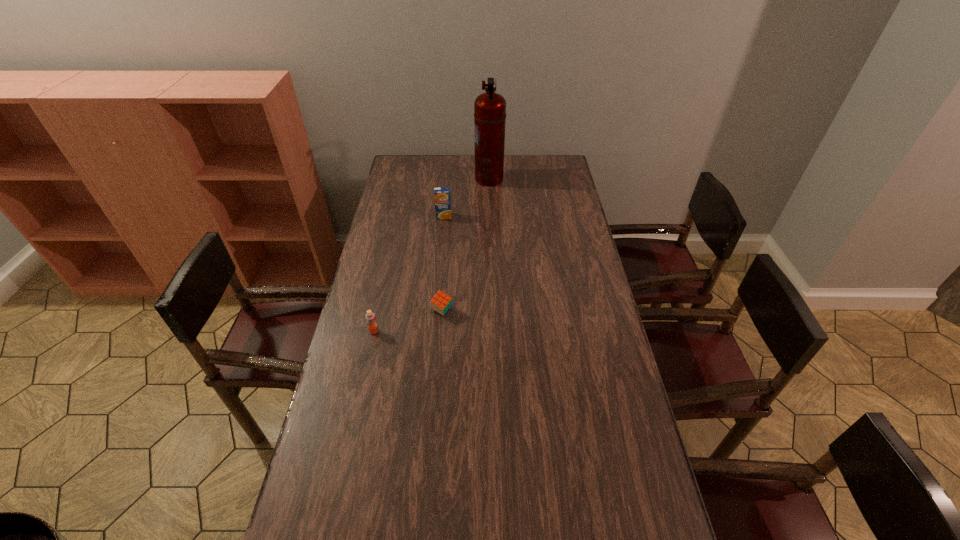
Find the location of `fire extinguisher`. fire extinguisher is located at coordinates (489, 108).

Find the location of `the rightmost object`. the rightmost object is located at coordinates (489, 108).

This screenshot has height=540, width=960. What are the coordinates of `the third nearest object` in the screenshot? It's located at (442, 194).

This screenshot has width=960, height=540. In order to click on the taller orange juice in this screenshot , I will do `click(442, 194)`.

The image size is (960, 540). Identify the location of the left orange juice. (370, 317).

Find the location of a particular element. Image resolution: width=960 pixels, height=540 pixels. the leftmost object is located at coordinates (370, 317).

Where is `cube`? The height and width of the screenshot is (540, 960). cube is located at coordinates (441, 302).

Image resolution: width=960 pixels, height=540 pixels. What are the coordinates of `the second nearest object` in the screenshot? It's located at (441, 302).

Find the location of a particular element. free space located 0.370m on the nozzle side of the farthest object is located at coordinates (399, 179).

Locate an element on the screen. The image size is (960, 540). free space located on the nozzle side of the farthest object is located at coordinates (393, 179).